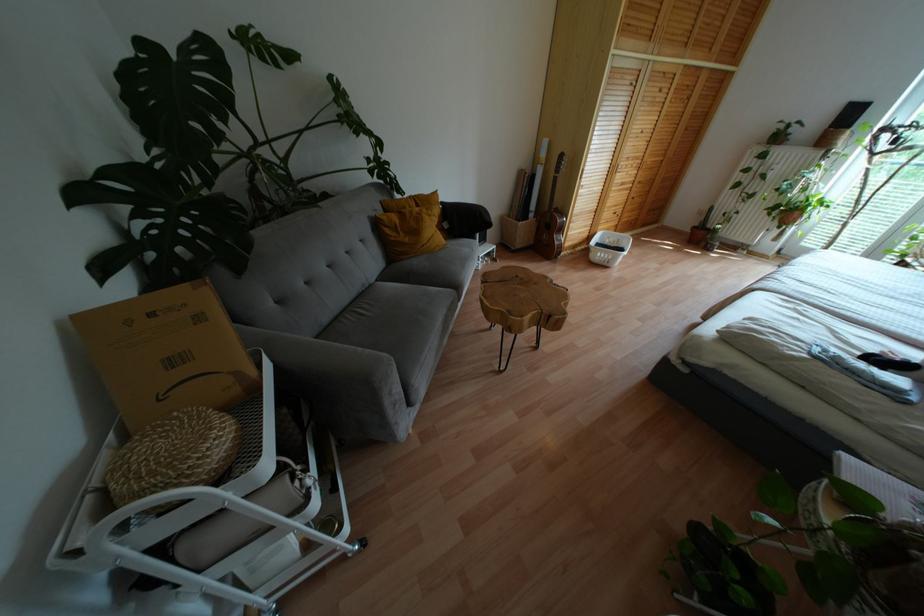
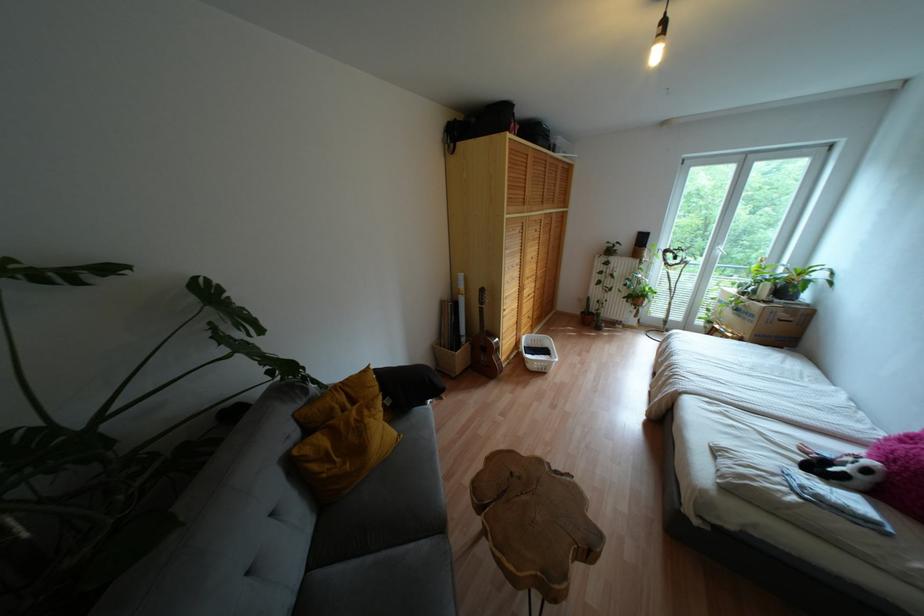
Where in the second image is the point corresponding to (394,228) from the first image?

(325, 458)